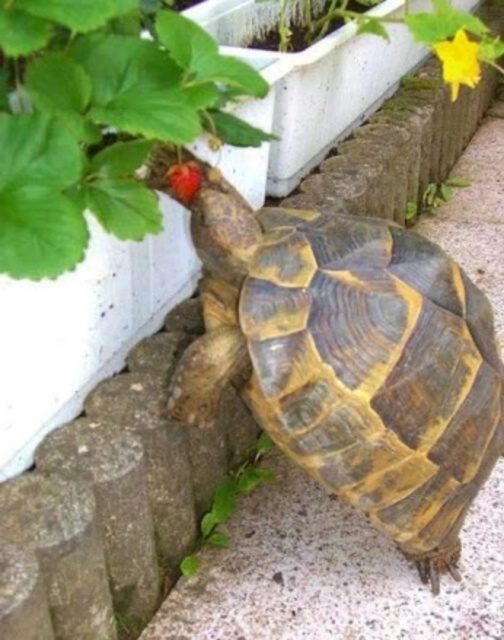
In the scene shown: Does brown textured tortoise at center have a larger size compared to yellow matte flower at upper right?

Yes.

Between brown textured tortoise at center and yellow matte flower at upper right, which one appears on the right side from the viewer's perspective?

yellow matte flower at upper right

The image size is (504, 640). Describe the element at coordinates (346, 356) in the screenshot. I see `brown textured tortoise at center` at that location.

Where is `brown textured tortoise at center`? This screenshot has height=640, width=504. brown textured tortoise at center is located at coordinates (346, 356).

Is point (341, 264) farther from viewer compared to point (186, 198)?

Yes, point (341, 264) is behind point (186, 198).

Measure the distance between brown textured tortoise at center and camera.

brown textured tortoise at center is 35.76 inches away from camera.

Who is more forward, (247,356) or (199,177)?

Positioned in front is point (199,177).

Find the location of a particular element. brown textured tortoise at center is located at coordinates (346, 356).

From the picture: Is green leafy plant at upper center positioned in front of ripe red berry at center?

No, green leafy plant at upper center is behind ripe red berry at center.

Who is higher up, green leafy plant at upper center or ripe red berry at center?

Positioned higher is green leafy plant at upper center.

Find the location of a particular element. green leafy plant at upper center is located at coordinates (432, 196).

What are the coordinates of `green leafy plant at upper center` in the screenshot? It's located at (432, 196).